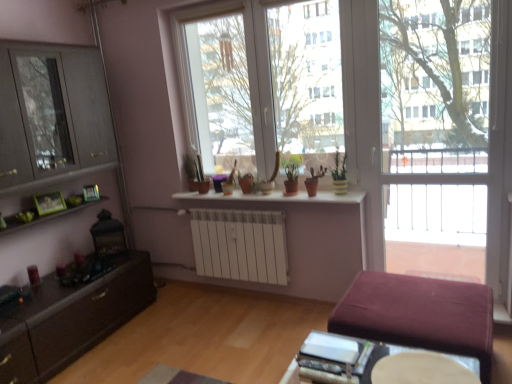
This screenshot has height=384, width=512. I want to click on blank space situated above velvet maroon ottoman at lower right (from a real-world perspective), so [414, 295].